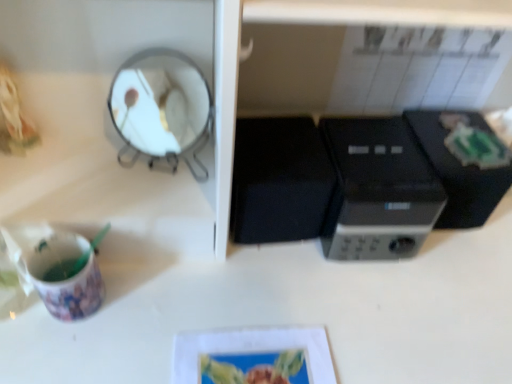
Question: Does black plastic microwave at center appear on the right side of black plastic microwave at center, the 2th appliance positioned from the left?

Choices:
 (A) no
 (B) yes

Answer: (A)

Question: Considering the relative sizes of black plastic microwave at center and black plastic microwave at center, the 2th appliance positioned from the left, in the image provided, is black plastic microwave at center shorter than black plastic microwave at center, the 2th appliance positioned from the left,?

Choices:
 (A) no
 (B) yes

Answer: (A)

Question: Does black plastic microwave at center have a greater width compared to black plastic microwave at center, which is the first appliance in right-to-left order?

Choices:
 (A) no
 (B) yes

Answer: (B)

Question: Does black plastic microwave at center come in front of black plastic microwave at center, which is the first appliance in right-to-left order?

Choices:
 (A) yes
 (B) no

Answer: (A)

Question: Is black plastic microwave at center to the left of black plastic microwave at center, the 2th appliance positioned from the left, from the viewer's perspective?

Choices:
 (A) no
 (B) yes

Answer: (B)

Question: In the image, is metallic silver mirror at upper left on the left side or the right side of matte plastic cup at lower left?

Choices:
 (A) right
 (B) left

Answer: (A)

Question: Looking at the image, does metallic silver mirror at upper left seem bigger or smaller compared to matte plastic cup at lower left?

Choices:
 (A) small
 (B) big

Answer: (B)

Question: From the image's perspective, is metallic silver mirror at upper left positioned above or below matte plastic cup at lower left?

Choices:
 (A) below
 (B) above

Answer: (B)

Question: From a real-world perspective, is metallic silver mirror at upper left physically located above or below matte plastic cup at lower left?

Choices:
 (A) above
 (B) below

Answer: (A)

Question: From their relative heights in the image, would you say black plastic microwave at center, which is the first appliance in right-to-left order, is taller or shorter than black plastic microwave at center?

Choices:
 (A) short
 (B) tall

Answer: (A)

Question: Considering the positions of black plastic microwave at center, the 2th appliance positioned from the left, and black plastic microwave at center in the image, is black plastic microwave at center, the 2th appliance positioned from the left, bigger or smaller than black plastic microwave at center?

Choices:
 (A) small
 (B) big

Answer: (A)

Question: Based on their positions, is black plastic microwave at center, the 2th appliance positioned from the left, located to the left or right of black plastic microwave at center?

Choices:
 (A) right
 (B) left

Answer: (A)

Question: Is black plastic microwave at center, the 2th appliance positioned from the left, spatially inside black plastic microwave at center, or outside of it?

Choices:
 (A) outside
 (B) inside

Answer: (A)

Question: In the image, is matte plastic cup at lower left on the left side or the right side of black plastic microwave at center?

Choices:
 (A) left
 (B) right

Answer: (A)

Question: Is matte plastic cup at lower left taller or shorter than black plastic microwave at center?

Choices:
 (A) short
 (B) tall

Answer: (A)